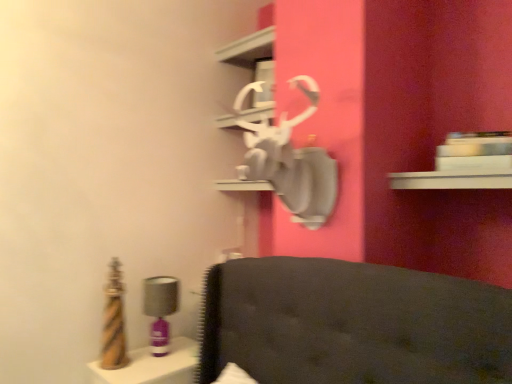
Measure the distance between point (259, 50) and camera.

Point (259, 50) is 2.48 meters away from camera.

Describe the element at coordinates (152, 366) in the screenshot. I see `metallic gold vanity at lower left` at that location.

Where is `white glossy shelf at upper center`? The height and width of the screenshot is (384, 512). white glossy shelf at upper center is located at coordinates (249, 49).

Could you tell me if white glossy shelf at upper center is turned towards matte purple table lamp at left?

No.

Based on the photo, from a real-world perspective, does white glossy shelf at upper center sit lower than matte purple table lamp at left?

No, from a real-world perspective, white glossy shelf at upper center is not beneath matte purple table lamp at left.

Is white glossy shelf at upper center wider or thinner than matte purple table lamp at left?

In the image, white glossy shelf at upper center appears to be wider than matte purple table lamp at left.

Which is in front, point (223, 58) or point (162, 284)?

The point (162, 284) is closer.

Is matte purple table lamp at left oriented away from white glossy shelf at upper center?

No, white glossy shelf at upper center is not at the back of matte purple table lamp at left.

Considering the sizes of objects matte purple table lamp at left and white glossy shelf at upper center in the image provided, who is shorter, matte purple table lamp at left or white glossy shelf at upper center?

With less height is white glossy shelf at upper center.

Identify the location of shelf above the matte purple table lamp at left (from a real-world perspective). (249, 49).

Which is in front, point (180, 351) or point (154, 291)?

Point (154, 291)

Which of these two, metallic gold vanity at lower left or matte purple table lamp at left, is wider?

metallic gold vanity at lower left is wider.

How many degrees apart are the facing directions of metallic gold vanity at lower left and matte purple table lamp at left?

0.559 degrees separate the facing orientations of metallic gold vanity at lower left and matte purple table lamp at left.

From a real-world perspective, between metallic gold vanity at lower left and matte purple table lamp at left, who is vertically lower?

metallic gold vanity at lower left is physically lower.

Measure the distance from metallic gold vanity at lower left to white glossy shelf at upper center.

metallic gold vanity at lower left is 5.37 feet away from white glossy shelf at upper center.

From a real-world perspective, is metallic gold vanity at lower left above or below white glossy shelf at upper center?

Clearly, from a real-world perspective, metallic gold vanity at lower left is below white glossy shelf at upper center.

Considering the sizes of objects metallic gold vanity at lower left and white glossy shelf at upper center in the image provided, who is shorter, metallic gold vanity at lower left or white glossy shelf at upper center?

white glossy shelf at upper center.

Considering the relative positions of metallic gold vanity at lower left and white glossy shelf at upper center in the image provided, is metallic gold vanity at lower left to the left of white glossy shelf at upper center from the viewer's perspective?

Yes, metallic gold vanity at lower left is to the left of white glossy shelf at upper center.

From the image's perspective, between white glossy shelf at upper center and metallic gold vanity at lower left, which one is located above?

white glossy shelf at upper center appears higher in the image.

Is point (243, 46) less distant than point (177, 354)?

No, it is not.

Looking at this image, which is behind, white glossy shelf at upper center or metallic gold vanity at lower left?

white glossy shelf at upper center is behind.

Does matte purple table lamp at left have a greater height compared to metallic gold vanity at lower left?

Correct, matte purple table lamp at left is much taller as metallic gold vanity at lower left.

From a real-world perspective, is matte purple table lamp at left under metallic gold vanity at lower left?

No, from a real-world perspective, matte purple table lamp at left is not under metallic gold vanity at lower left.

Considering the positions of objects matte purple table lamp at left and metallic gold vanity at lower left in the image provided, who is in front, matte purple table lamp at left or metallic gold vanity at lower left?

metallic gold vanity at lower left.

Where is `shelf located on the right of matte purple table lamp at left`? shelf located on the right of matte purple table lamp at left is located at coordinates (249, 49).

Where is `table lamp below the white glossy shelf at upper center (from the image's perspective)`? Image resolution: width=512 pixels, height=384 pixels. table lamp below the white glossy shelf at upper center (from the image's perspective) is located at coordinates (160, 310).

Looking at the image, which one is located further to matte purple table lamp at left, white glossy shelf at upper center or metallic gold vanity at lower left?

The object further to matte purple table lamp at left is white glossy shelf at upper center.

From the image, which object appears to be farther from white glossy shelf at upper center, matte purple table lamp at left or metallic gold vanity at lower left?

Among the two, metallic gold vanity at lower left is located further to white glossy shelf at upper center.

Which object lies further to the anchor point metallic gold vanity at lower left, white glossy shelf at upper center or matte purple table lamp at left?

white glossy shelf at upper center is positioned further to the anchor metallic gold vanity at lower left.

Estimate the real-world distances between objects in this image. Which object is further from white glossy shelf at upper center, metallic gold vanity at lower left or matte purple table lamp at left?

The object further to white glossy shelf at upper center is metallic gold vanity at lower left.

Which object lies further to the anchor point matte purple table lamp at left, metallic gold vanity at lower left or white glossy shelf at upper center?

The object further to matte purple table lamp at left is white glossy shelf at upper center.

When comparing their distances from metallic gold vanity at lower left, does matte purple table lamp at left or white glossy shelf at upper center seem further?

white glossy shelf at upper center is positioned further to the anchor metallic gold vanity at lower left.

Where is `table lamp between white glossy shelf at upper center and metallic gold vanity at lower left vertically`? table lamp between white glossy shelf at upper center and metallic gold vanity at lower left vertically is located at coordinates (160, 310).